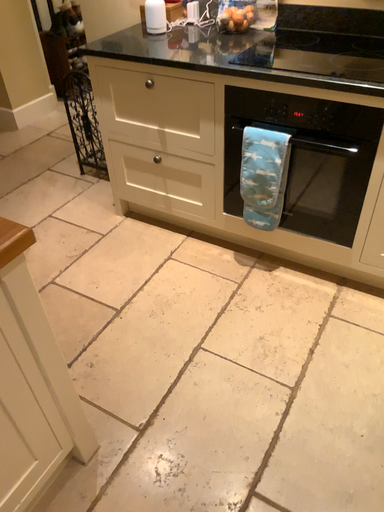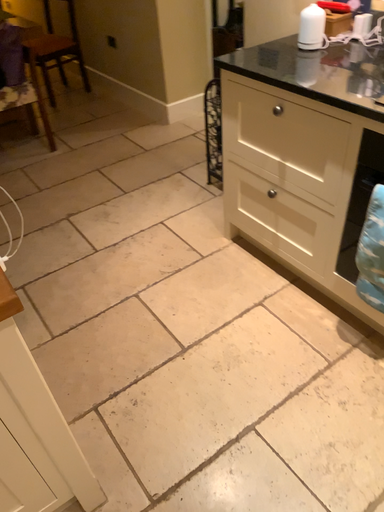
Question: How did the camera likely rotate when shooting the video?

Choices:
 (A) rotated right
 (B) rotated left

Answer: (B)